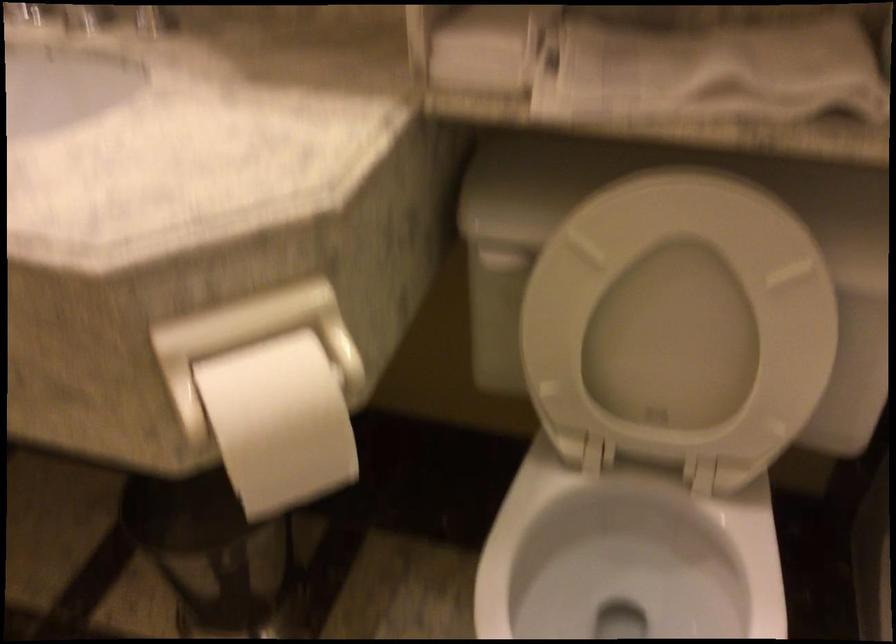
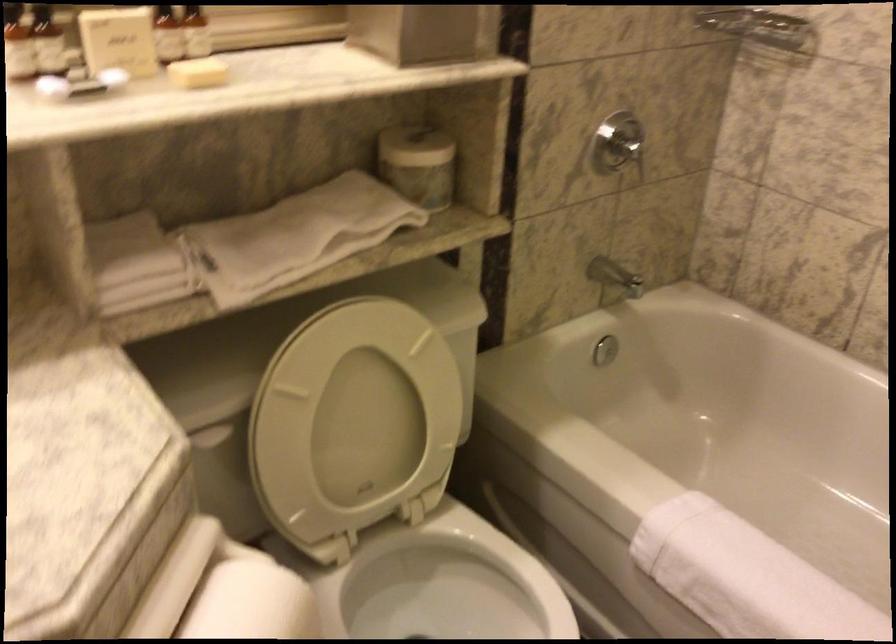
Question: The first image is from the beginning of the video and the second image is from the end. How did the camera likely rotate when shooting the video?

Choices:
 (A) Left
 (B) Right
 (C) Up
 (D) Down

Answer: (B)